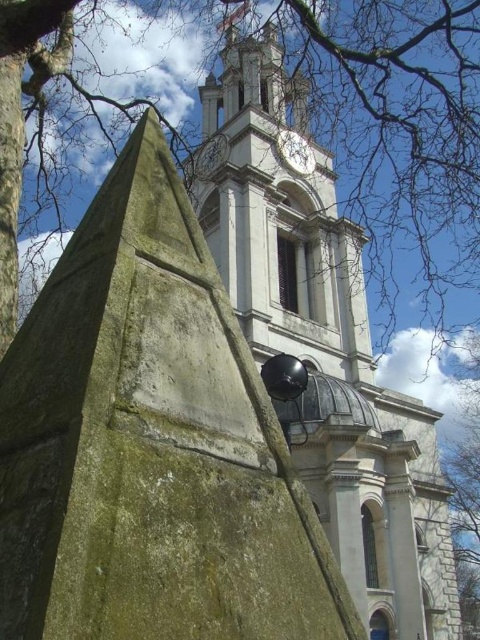
Question: Can you confirm if white stone clock tower at upper center is positioned to the right of white glossy clock at upper center?

Choices:
 (A) yes
 (B) no

Answer: (B)

Question: Which point appears farthest from the camera in this image?

Choices:
 (A) (286, 148)
 (B) (273, 276)

Answer: (A)

Question: Which object is closer to the camera taking this photo?

Choices:
 (A) white glossy clock at upper center
 (B) white stone clock tower at upper center

Answer: (B)

Question: Does white stone clock tower at upper center have a larger size compared to white glossy clock at upper center?

Choices:
 (A) no
 (B) yes

Answer: (B)

Question: Can you confirm if white stone clock tower at upper center is positioned to the right of white glossy clock at upper center?

Choices:
 (A) no
 (B) yes

Answer: (A)

Question: Which point is closer to the camera taking this photo?

Choices:
 (A) (290, 141)
 (B) (324, 228)

Answer: (B)